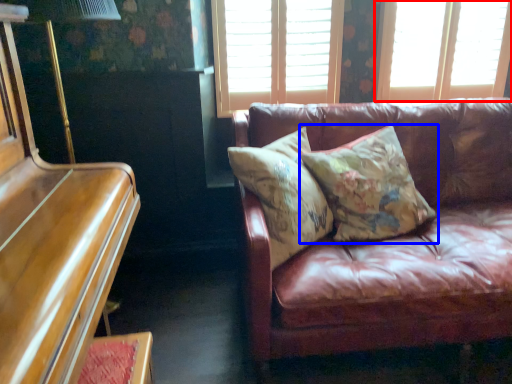
Question: Among these objects, which one is farthest to the camera, window (highlighted by a red box) or pillow (highlighted by a blue box)?

Choices:
 (A) window
 (B) pillow

Answer: (A)